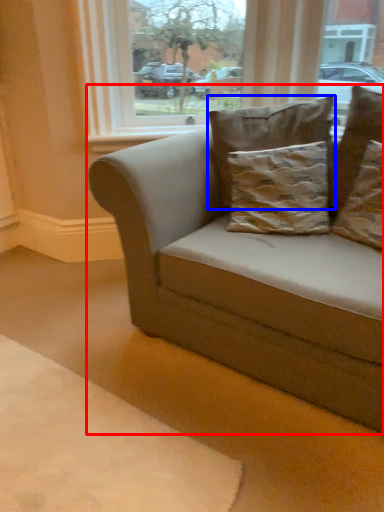
Question: Which point is closer to the camera, studio couch (highlighted by a red box) or pillow (highlighted by a blue box)?

Choices:
 (A) studio couch
 (B) pillow

Answer: (A)